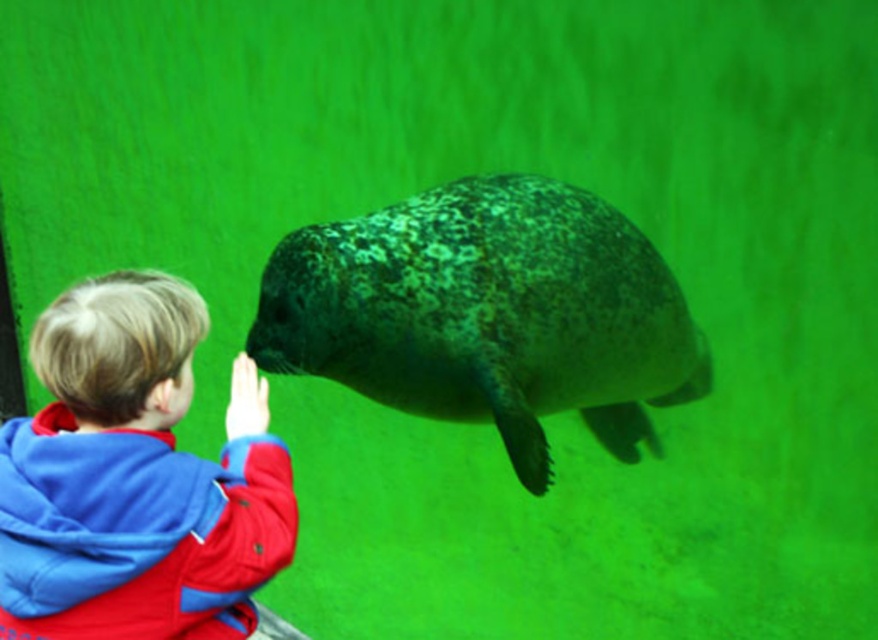
Which is above, speckled dark green seal at center or blue fleece jacket at lower left?

speckled dark green seal at center

Does speckled dark green seal at center have a lesser height compared to blue fleece jacket at lower left?

No, speckled dark green seal at center is not shorter than blue fleece jacket at lower left.

Who is more distant from viewer, (318,244) or (56,499)?

Point (318,244)

At what (x,y) coordinates should I click in order to perform the action: click on speckled dark green seal at center. Please return your answer as a coordinate pair (x, y). The height and width of the screenshot is (640, 878). Looking at the image, I should click on (488, 314).